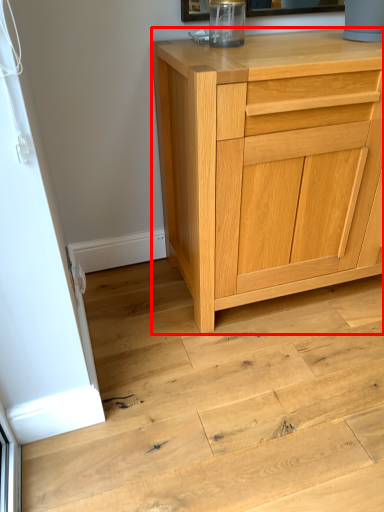
Question: From the image's perspective, where is chest of drawers (annotated by the red box) located in relation to stair in the image?

Choices:
 (A) above
 (B) below

Answer: (A)